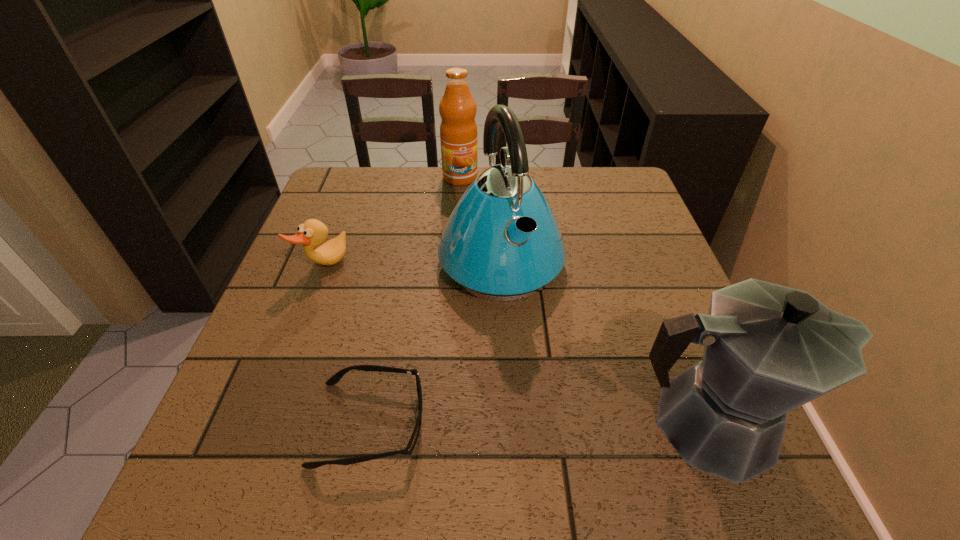
This screenshot has width=960, height=540. I want to click on vacant area located on the beak of the fourth tallest object, so click(448, 351).

I want to click on free region located 0.160m on the beak of the fourth tallest object, so click(385, 309).

Locate an element on the screen. The image size is (960, 540). vacant space located on the beak of the fourth tallest object is located at coordinates (379, 305).

Find the location of a particular element. free location located at the spout of the kettle is located at coordinates (535, 335).

Find the location of a particular element. The width and height of the screenshot is (960, 540). vacant space located at the spout of the kettle is located at coordinates (537, 339).

Identify the location of blank space located at the spout of the kettle. This screenshot has width=960, height=540. (556, 380).

Where is `object at the far edge`? Image resolution: width=960 pixels, height=540 pixels. object at the far edge is located at coordinates (458, 130).

Find the location of a particular element. The height and width of the screenshot is (540, 960). spectacles that is at the near edge is located at coordinates (334, 379).

Where is `coffeepot that is at the near edge`? coffeepot that is at the near edge is located at coordinates (768, 349).

This screenshot has width=960, height=540. In order to click on object located at the left edge in this screenshot , I will do `click(312, 233)`.